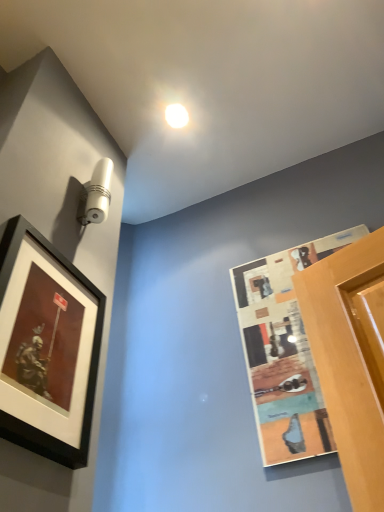
Question: In the image, is matte black picture frame at left, which is the first picture frame from left to right, positioned in front of or behind wooden textured picture frame at right, which is the second picture frame in left-to-right order?

Choices:
 (A) behind
 (B) front

Answer: (B)

Question: From the image's perspective, relative to wooden textured picture frame at right, acting as the 1th picture frame starting from the right, is matte black picture frame at left, which is the first picture frame from left to right, above or below?

Choices:
 (A) above
 (B) below

Answer: (A)

Question: Based on their relative distances, which object is nearer to the white glossy droplight at upper center?

Choices:
 (A) matte black picture frame at left, acting as the 2th picture frame starting from the right
 (B) wooden textured picture frame at right, acting as the 1th picture frame starting from the right

Answer: (B)

Question: Which is nearer to the matte black picture frame at left, acting as the 2th picture frame starting from the right?

Choices:
 (A) wooden textured picture frame at right, acting as the 1th picture frame starting from the right
 (B) white glossy droplight at upper center

Answer: (A)